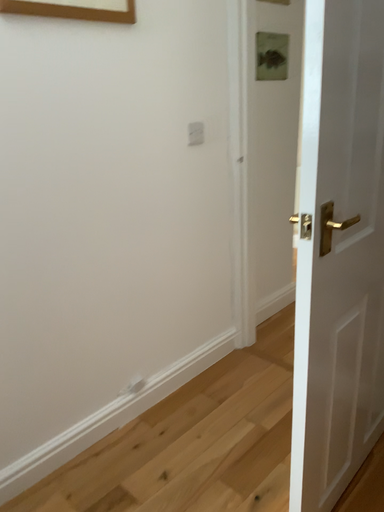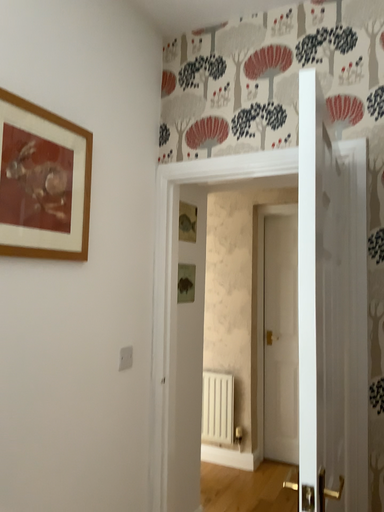
Question: Which way did the camera rotate in the video?

Choices:
 (A) rotated downward
 (B) rotated upward

Answer: (B)